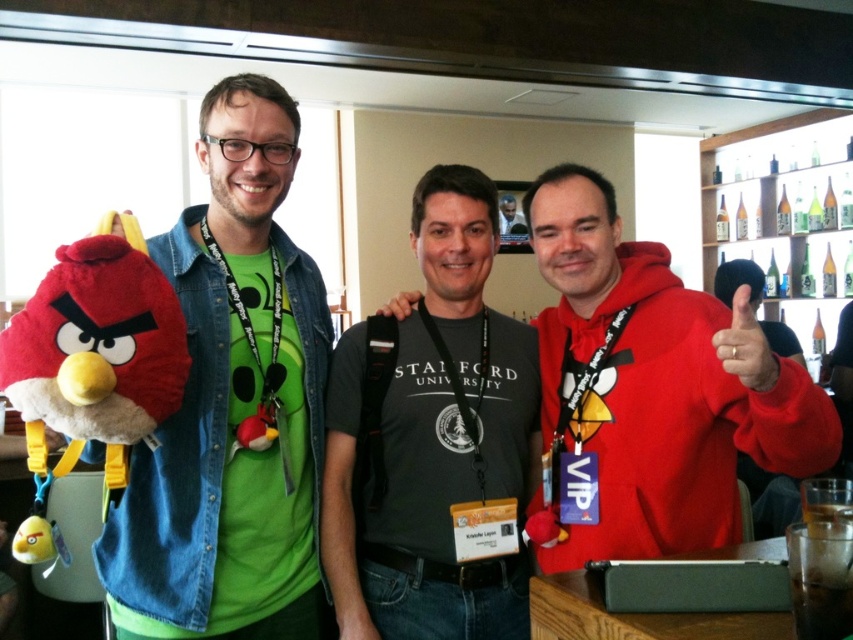
Question: Does matte red hoodie at center have a greater width compared to soft plush toy at left?

Choices:
 (A) no
 (B) yes

Answer: (A)

Question: Among these objects, which one is nearest to the camera?

Choices:
 (A) red matte plush at center right
 (B) dark gray t-shirt at center

Answer: (A)

Question: Can you confirm if matte plush toy at left is positioned to the left of matte red hoodie at center?

Choices:
 (A) yes
 (B) no

Answer: (A)

Question: Which of the following is the closest to the observer?

Choices:
 (A) coord(743,381)
 (B) coord(378,596)

Answer: (A)

Question: Which point is farther to the camera?

Choices:
 (A) (738, 349)
 (B) (498, 417)
 (C) (508, 200)
 (D) (219, 273)

Answer: (C)

Question: Can you confirm if matte red hoodie at center is positioned to the left of red matte plush at center right?

Choices:
 (A) no
 (B) yes

Answer: (B)